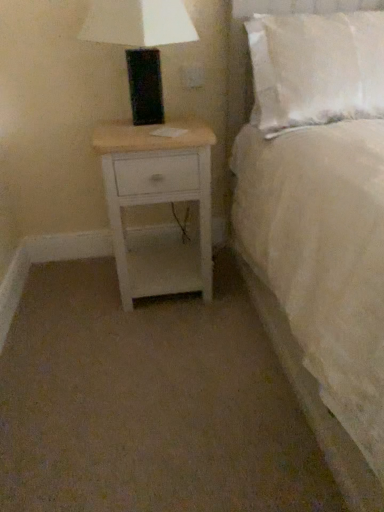
You are a GUI agent. You are given a task and a screenshot of the screen. Output one action in this format:
    pyautogui.click(x=<x>, y=<y>)
    Task: Click on the free space above white wood nightstand at lower left (from a real-world perspective)
    This screenshot has width=384, height=512.
    Given the screenshot: What is the action you would take?
    pyautogui.click(x=156, y=127)